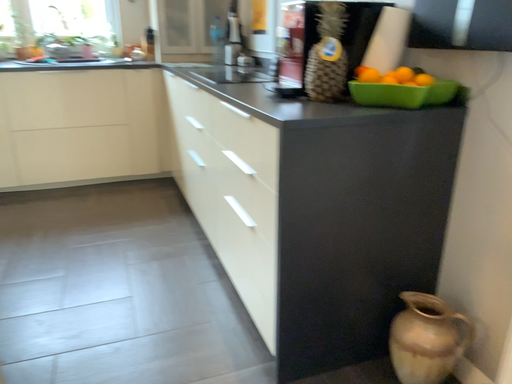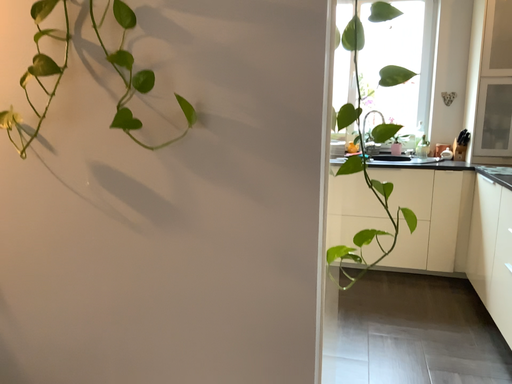
Question: Which way did the camera rotate in the video?

Choices:
 (A) rotated downward
 (B) rotated upward

Answer: (B)